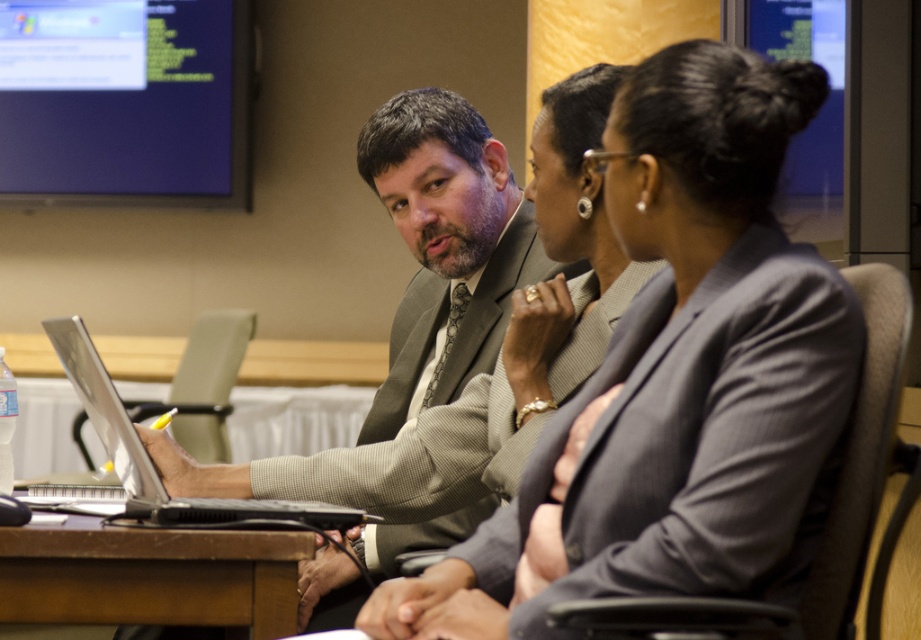
Question: Observing the image, what is the correct spatial positioning of gray suit at center in reference to brown wooden table at lower left?

Choices:
 (A) right
 (B) left

Answer: (A)

Question: Does matte black monitor at upper left appear over silver/black laptop at left?

Choices:
 (A) yes
 (B) no

Answer: (A)

Question: Among these objects, which one is nearest to the camera?

Choices:
 (A) matte black monitor at upper left
 (B) brown wooden table at lower left

Answer: (B)

Question: Is gray textured blazer at center bigger than brown wooden table at lower left?

Choices:
 (A) yes
 (B) no

Answer: (A)

Question: Which object appears farthest from the camera in this image?

Choices:
 (A) matte black monitor at upper left
 (B) brown wooden table at lower left
 (C) gray suit at center
 (D) gray textured blazer at center

Answer: (A)

Question: Which of the following is the closest to the observer?

Choices:
 (A) (170, 109)
 (B) (532, 627)
 (C) (143, 538)
 (D) (146, 518)

Answer: (B)